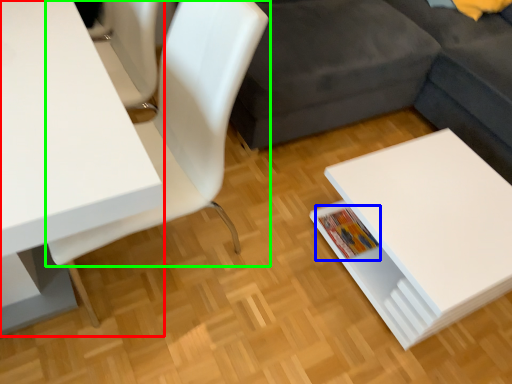
Question: Considering the real-world distances, which object is farthest from table (highlighted by a red box)? book (highlighted by a blue box) or chair (highlighted by a green box)?

Choices:
 (A) book
 (B) chair

Answer: (A)